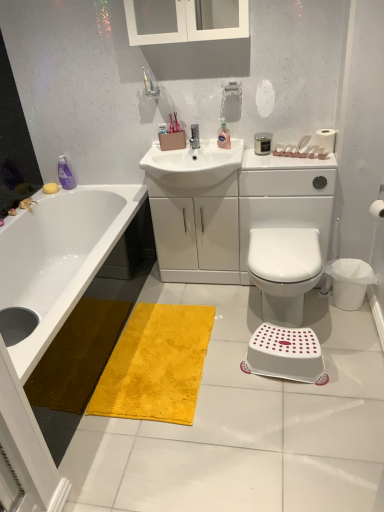
Question: Is translucent plastic soap dispenser at upper center, the 2th toiletry viewed from the right, inside the boundaries of white glass medicine cabinet at upper center, or outside?

Choices:
 (A) inside
 (B) outside

Answer: (B)

Question: Considering the positions of translucent plastic soap dispenser at upper center, arranged as the 2th toiletry when viewed from the front, and white glass medicine cabinet at upper center in the image, is translucent plastic soap dispenser at upper center, arranged as the 2th toiletry when viewed from the front, wider or thinner than white glass medicine cabinet at upper center?

Choices:
 (A) wide
 (B) thin

Answer: (B)

Question: Which object is the closest to the white plastic bidet at center?

Choices:
 (A) matte silver faucet at center
 (B) yellow matte soap at upper left
 (C) white matte toilet paper at right, the second toilet paper viewed from the top
 (D) white glass medicine cabinet at upper center
 (E) white paper at upper right, which appears as the 2th toilet paper when ordered from the bottom

Answer: (C)

Question: Which is nearer to the yellow matte soap at upper left?

Choices:
 (A) white glossy sink at center
 (B) purple glossy bottle at upper left, the first toiletry viewed from the back
 (C) white glass medicine cabinet at upper center
 (D) satin black candle at upper right, marked as the 1th toiletry in a front-to-back arrangement
 (E) translucent plastic soap dispenser at upper center, arranged as the 2th toiletry when viewed from the front

Answer: (B)